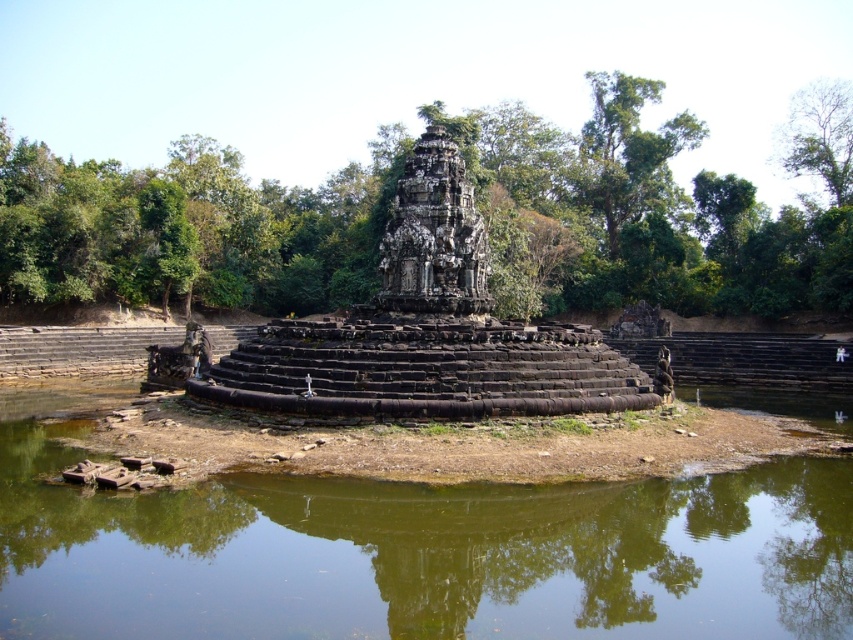
You are a visitor standing at the edge of the water, looking towards the temple. You see the green leafy tree at center and the dark gray stone ruins at center. Which object is closer to your left side?

The green leafy tree at center is positioned on the left side of dark gray stone ruins at center, so it is closer to your left side.

You are standing at the edge of the water near the ancient stone temple. You want to walk to the green leafy tree at center. Which direction should you go from your current position?

The green leafy tree at center is located at coordinates point (653, 211), so you should walk towards the center of the image to reach it.